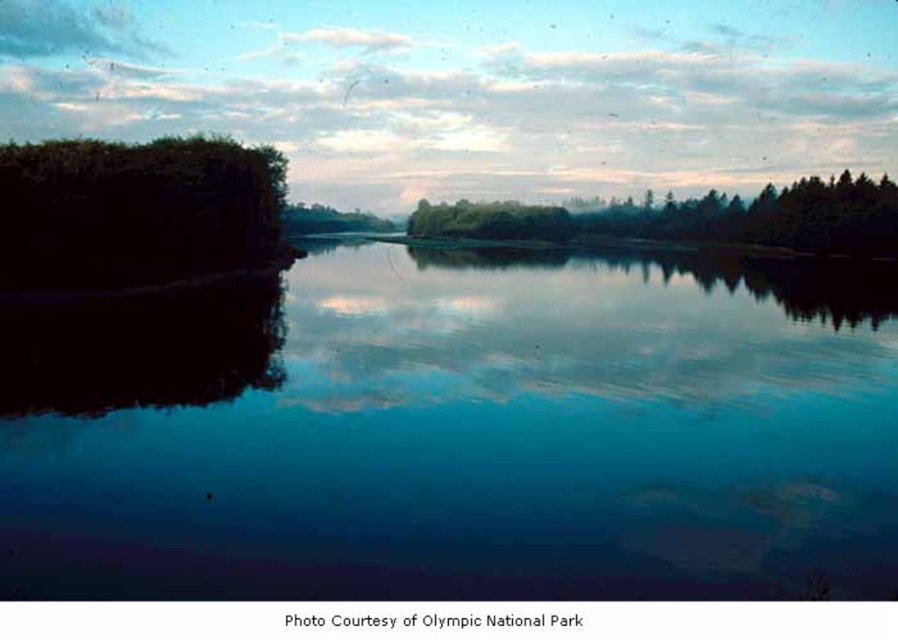
Does transparent water at center have a larger size compared to green matte trees at center?

No, transparent water at center is not bigger than green matte trees at center.

Measure the distance between point (359,577) and camera.

Result: Point (359,577) and camera are 62.49 meters apart.

The width and height of the screenshot is (898, 640). Find the location of `transparent water at center`. transparent water at center is located at coordinates (465, 435).

Does transparent water at center appear over green leafy tree at left?

Incorrect, transparent water at center is not positioned above green leafy tree at left.

Between transparent water at center and green leafy tree at left, which one is positioned higher?

green leafy tree at left

Between point (461, 301) and point (71, 204), which one is positioned in front?

Point (71, 204)

This screenshot has width=898, height=640. I want to click on transparent water at center, so click(465, 435).

Who is lower down, green leafy tree at left or green matte trees at center?

green leafy tree at left

How distant is green leafy tree at left from green matte trees at center?

green leafy tree at left and green matte trees at center are 289.64 meters apart from each other.

This screenshot has width=898, height=640. I want to click on green leafy tree at left, so (x=135, y=211).

At what (x,y) coordinates should I click in order to perform the action: click on green leafy tree at left. Please return your answer as a coordinate pair (x, y). Looking at the image, I should click on (135, 211).